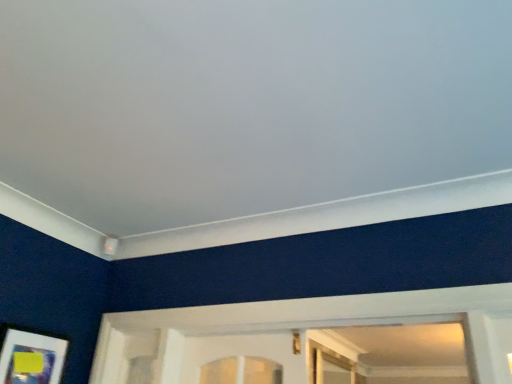
Locate an element on the screen. This screenshot has width=512, height=384. matte black picture frame at lower left is located at coordinates (31, 358).

The image size is (512, 384). What do you see at coordinates (31, 358) in the screenshot?
I see `matte black picture frame at lower left` at bounding box center [31, 358].

Where is `matte black picture frame at lower left`? This screenshot has height=384, width=512. matte black picture frame at lower left is located at coordinates point(31,358).